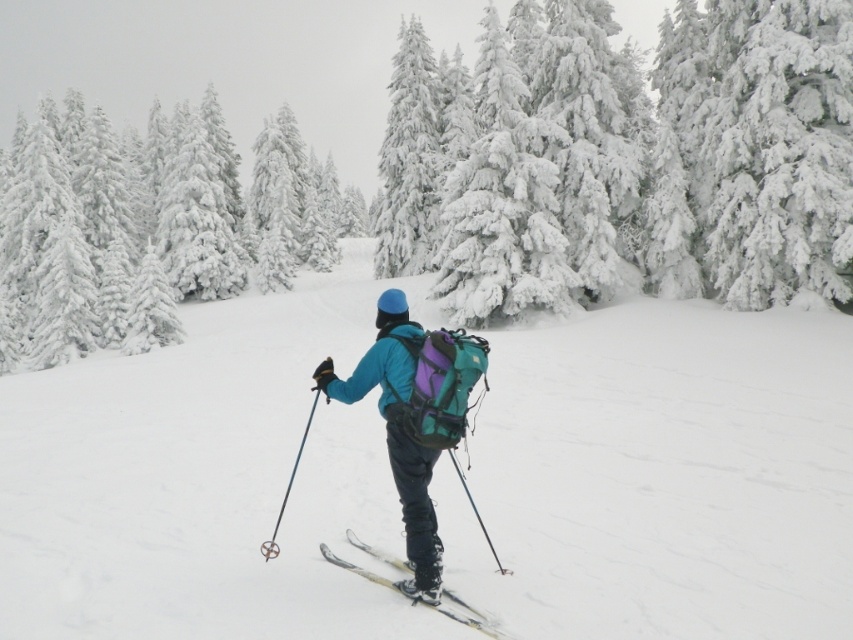
Question: Which point is farther to the camera?

Choices:
 (A) white snow-covered trees at upper left
 (B) white snow-covered tree at upper center
 (C) yellow metallic skis at center

Answer: (A)

Question: Which of the following is the farthest from the observer?

Choices:
 (A) (192, 257)
 (B) (489, 394)
 (C) (438, 584)
 (D) (357, 547)

Answer: (A)

Question: Is white snow-covered tree at upper center in front of yellow metallic skis at center?

Choices:
 (A) yes
 (B) no

Answer: (B)

Question: Observing the image, what is the correct spatial positioning of white snow-covered tree at center in reference to white snow-covered trees at upper left?

Choices:
 (A) right
 (B) left

Answer: (B)

Question: Among these objects, which one is farthest from the camera?

Choices:
 (A) white snow-covered trees at upper left
 (B) white snow ski slope at center
 (C) yellow metallic skis at center
 (D) white snow-covered tree at upper center

Answer: (A)

Question: In this image, where is white snow-covered trees at upper left located relative to yellow metallic skis at center?

Choices:
 (A) above
 (B) below

Answer: (A)